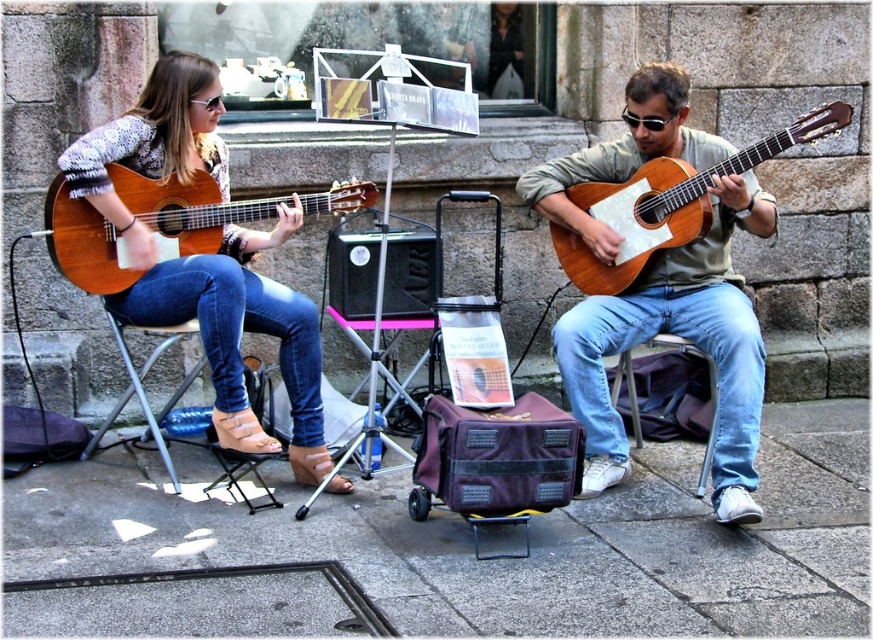
Between matte black guitar at left and white plastic chair at lower center, which one appears on the left side from the viewer's perspective?

Positioned to the left is matte black guitar at left.

How far apart are matte black guitar at left and white plastic chair at lower center?

matte black guitar at left is 1.90 meters away from white plastic chair at lower center.

Does point (236, 403) lie in front of point (713, 412)?

Yes, point (236, 403) is in front of point (713, 412).

Identify the location of matte black guitar at left. (205, 259).

Between smooth concrete pavement at center and white plastic chair at lower center, which one appears on the right side from the viewer's perspective?

white plastic chair at lower center is more to the right.

Does smooth concrete pavement at center have a smaller size compared to white plastic chair at lower center?

Incorrect, smooth concrete pavement at center is not smaller in size than white plastic chair at lower center.

Between point (537, 572) and point (699, 490), which one is positioned behind?

Point (699, 490)

I want to click on smooth concrete pavement at center, so click(530, 541).

Consider the image. Does matte wood guitar at left appear under light brown wood guitar at right?

Correct, matte wood guitar at left is located below light brown wood guitar at right.

Is matte wood guitar at left wider than light brown wood guitar at right?

Yes, matte wood guitar at left is wider than light brown wood guitar at right.

The width and height of the screenshot is (873, 640). What are the coordinates of `matte wood guitar at left` in the screenshot? It's located at (186, 209).

Identify the location of matte wood guitar at left. (186, 209).